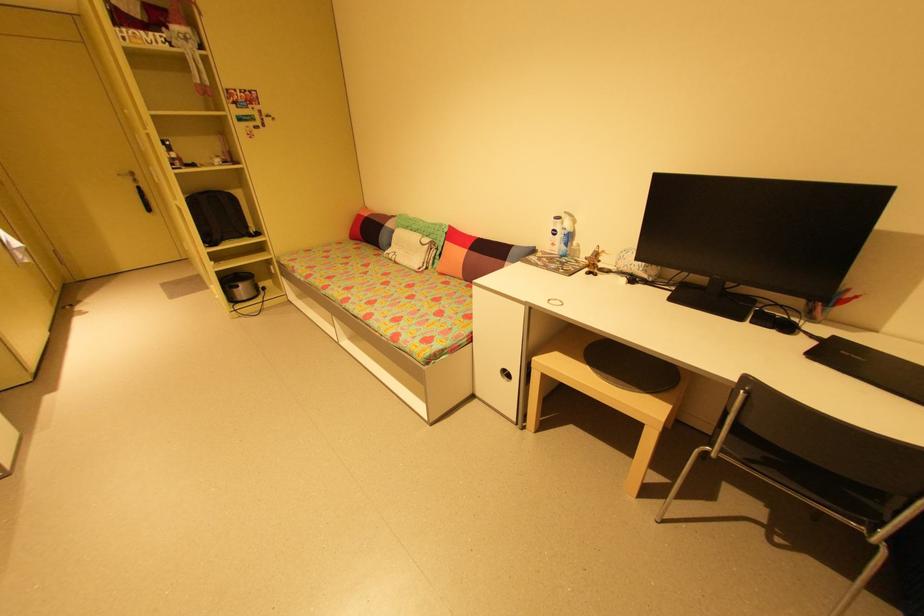
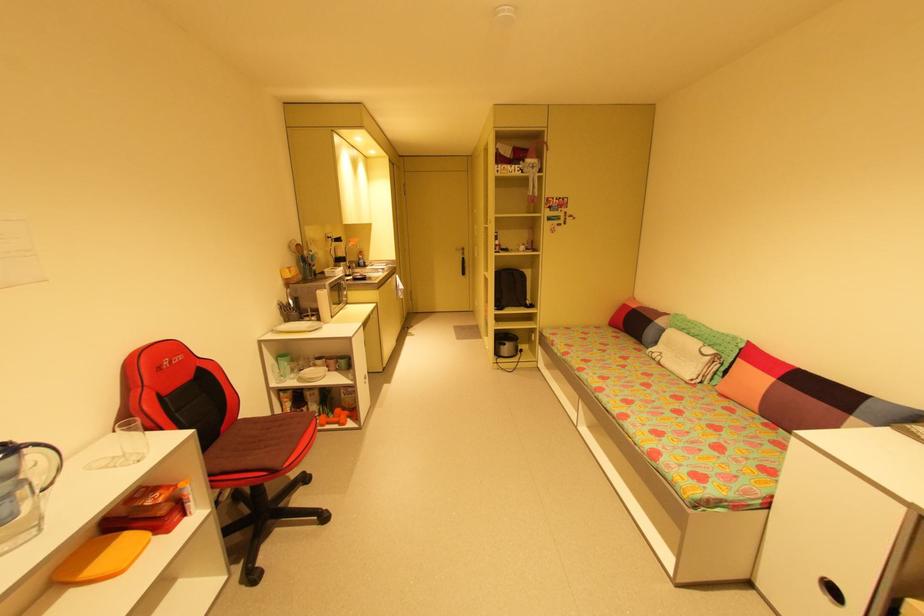
The point at (480, 400) is marked in the first image. Where is the corresponding point in the second image?

(758, 593)